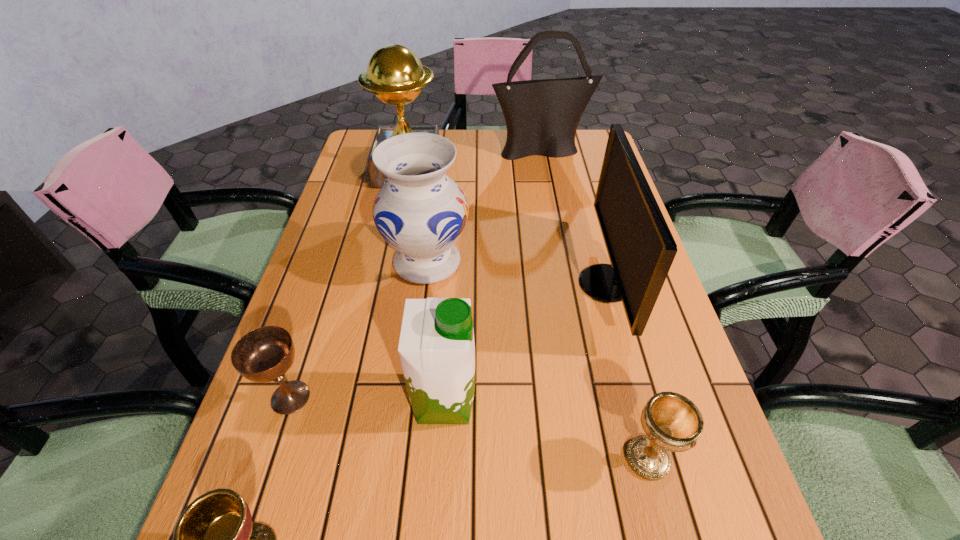
I want to click on chalice that is at the left edge, so click(265, 354).

Where is `shoulder bag at the right edge`? The height and width of the screenshot is (540, 960). shoulder bag at the right edge is located at coordinates (542, 116).

The width and height of the screenshot is (960, 540). I want to click on computer monitor that is at the right edge, so click(x=641, y=249).

You are a GUI agent. You are given a task and a screenshot of the screen. Output one action in this format:
    pyautogui.click(x=<x>, y=<y>)
    Task: Click on the chalice positioned at the right edge
    
    Given the screenshot: What is the action you would take?
    pyautogui.click(x=672, y=422)

This screenshot has height=540, width=960. What are the coordinates of `object present at the far left corner` in the screenshot? It's located at (395, 74).

Identify the location of object located in the far right corner section of the desktop. This screenshot has height=540, width=960. tap(542, 116).

The height and width of the screenshot is (540, 960). Identify the location of vacant space at the far edge. (494, 131).

At what (x,y) coordinates should I click in order to perform the action: click on vacant space at the left edge of the desktop. Please return your answer as a coordinate pair (x, y). The width and height of the screenshot is (960, 540). Looking at the image, I should click on (294, 504).

At what (x,y) coordinates should I click in order to perform the action: click on free region at the right edge of the desktop. Please return your answer as a coordinate pair (x, y). Image resolution: width=960 pixels, height=540 pixels. Looking at the image, I should click on (610, 364).

You are a GUI agent. You are given a task and a screenshot of the screen. Output one action in this format:
    pyautogui.click(x=<x>, y=<y>)
    Task: Click on the free location at the far right corner of the desktop
    The width and height of the screenshot is (960, 540).
    Given the screenshot: What is the action you would take?
    pyautogui.click(x=561, y=166)